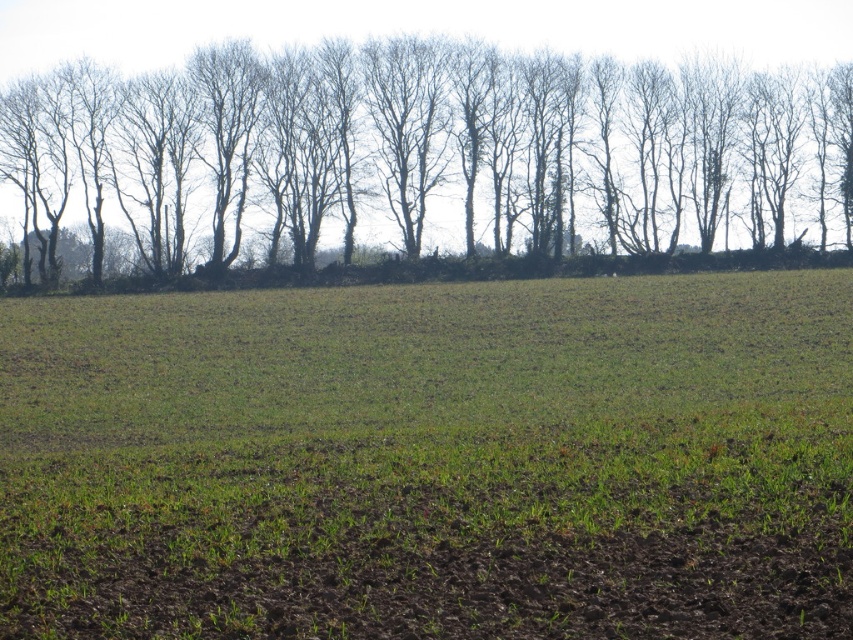
Question: Does green grassy field at center have a smaller size compared to bare branches at upper center?

Choices:
 (A) yes
 (B) no

Answer: (A)

Question: Is green grassy field at center smaller than bare branches at upper center?

Choices:
 (A) no
 (B) yes

Answer: (B)

Question: Is green grassy field at center positioned behind bare branches at upper center?

Choices:
 (A) yes
 (B) no

Answer: (B)

Question: Which point is closer to the camera taking this photo?

Choices:
 (A) tap(532, 552)
 (B) tap(18, 106)

Answer: (A)